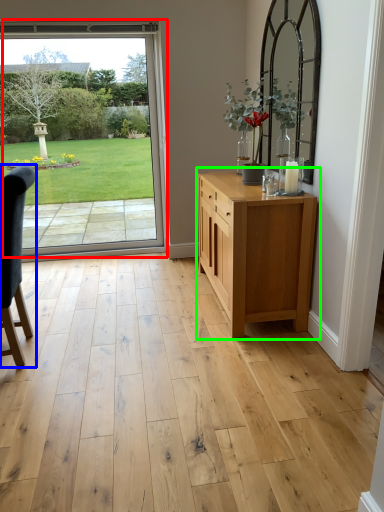
Question: Which is farther away from door (highlighted by a red box)? chair (highlighted by a blue box) or chest of drawers (highlighted by a green box)?

Choices:
 (A) chair
 (B) chest of drawers

Answer: (A)